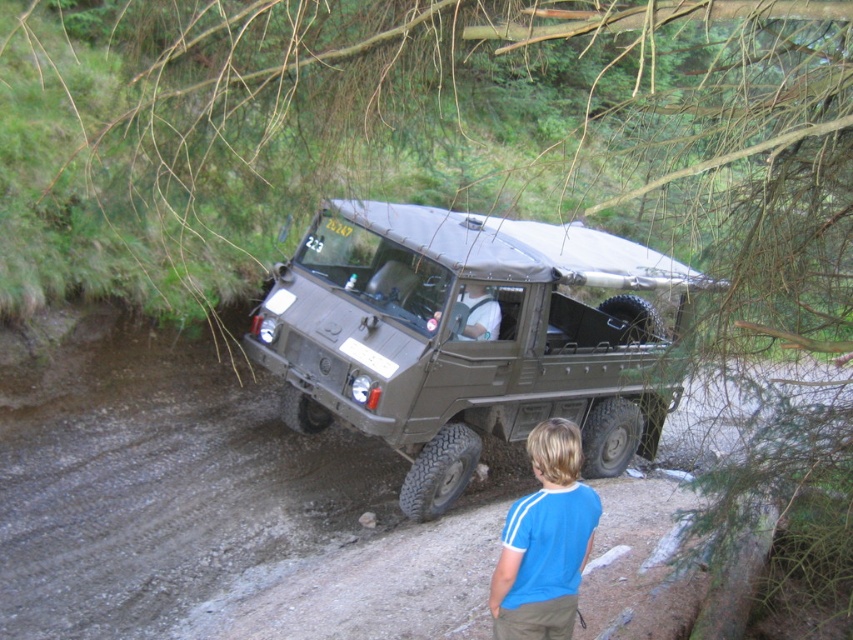
Between matte green military vehicle at center and blue cotton shirt at lower center, which one is positioned higher?

matte green military vehicle at center is above.

Which is behind, point (581, 374) or point (585, 522)?

Positioned behind is point (581, 374).

Does point (640, 308) come farther from viewer compared to point (584, 508)?

Yes.

I want to click on matte green military vehicle at center, so click(469, 337).